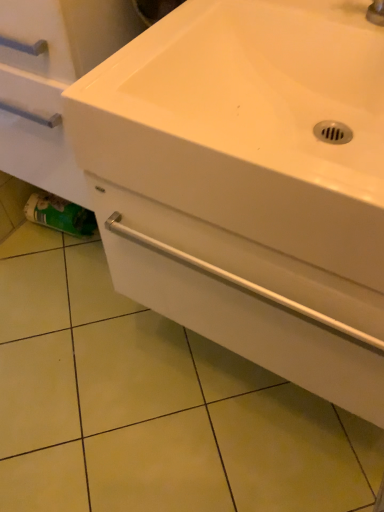
Question: Is green matte toilet paper at lower left positioned beyond the bounds of white glossy drawer at center?

Choices:
 (A) no
 (B) yes

Answer: (B)

Question: From a real-world perspective, is green matte toilet paper at lower left located higher than white glossy drawer at center?

Choices:
 (A) no
 (B) yes

Answer: (A)

Question: Would you consider green matte toilet paper at lower left to be distant from white glossy drawer at center?

Choices:
 (A) no
 (B) yes

Answer: (A)

Question: Can white glossy drawer at center be found inside green matte toilet paper at lower left?

Choices:
 (A) no
 (B) yes

Answer: (A)

Question: Does green matte toilet paper at lower left have a larger size compared to white glossy drawer at center?

Choices:
 (A) yes
 (B) no

Answer: (B)

Question: From their relative heights in the image, would you say green matte toilet paper at lower left is taller or shorter than white glossy sink at center?

Choices:
 (A) short
 (B) tall

Answer: (A)

Question: From a real-world perspective, is green matte toilet paper at lower left positioned above or below white glossy sink at center?

Choices:
 (A) below
 (B) above

Answer: (A)

Question: Considering their positions, is green matte toilet paper at lower left located in front of or behind white glossy sink at center?

Choices:
 (A) front
 (B) behind

Answer: (B)

Question: From the image's perspective, is green matte toilet paper at lower left located above or below white glossy sink at center?

Choices:
 (A) above
 (B) below

Answer: (B)

Question: Considering the positions of green matte toilet paper at lower left and white glossy drawer at center in the image, is green matte toilet paper at lower left bigger or smaller than white glossy drawer at center?

Choices:
 (A) small
 (B) big

Answer: (A)

Question: In the image, is green matte toilet paper at lower left on the left side or the right side of white glossy drawer at center?

Choices:
 (A) right
 (B) left

Answer: (B)

Question: Is point (71, 208) closer or farther from the camera than point (253, 272)?

Choices:
 (A) closer
 (B) farther

Answer: (B)

Question: Considering the positions of green matte toilet paper at lower left and white glossy drawer at center in the image, is green matte toilet paper at lower left wider or thinner than white glossy drawer at center?

Choices:
 (A) wide
 (B) thin

Answer: (B)

Question: In the image, is white glossy sink at center on the left side or the right side of green matte toilet paper at lower left?

Choices:
 (A) right
 (B) left

Answer: (A)

Question: Considering the positions of white glossy sink at center and green matte toilet paper at lower left in the image, is white glossy sink at center wider or thinner than green matte toilet paper at lower left?

Choices:
 (A) thin
 (B) wide

Answer: (B)